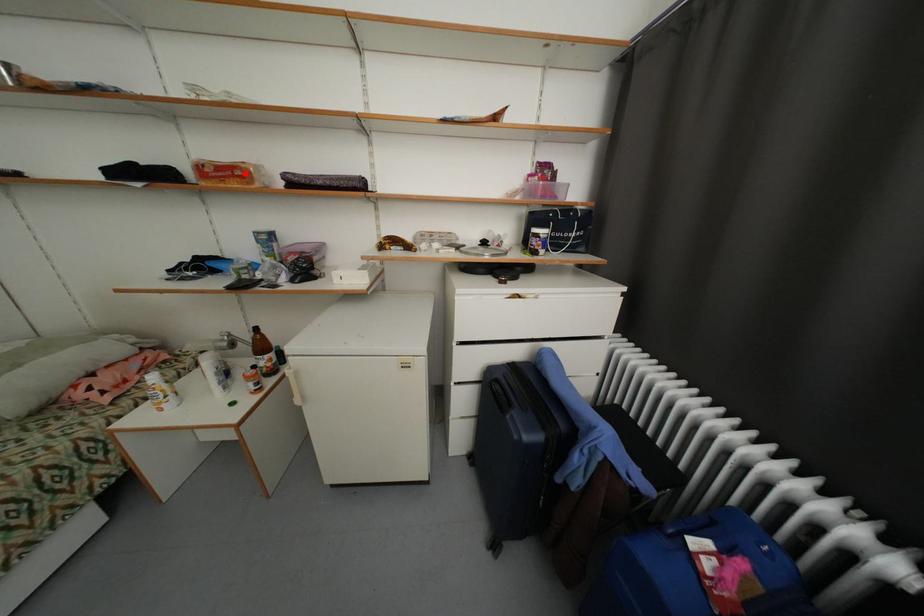
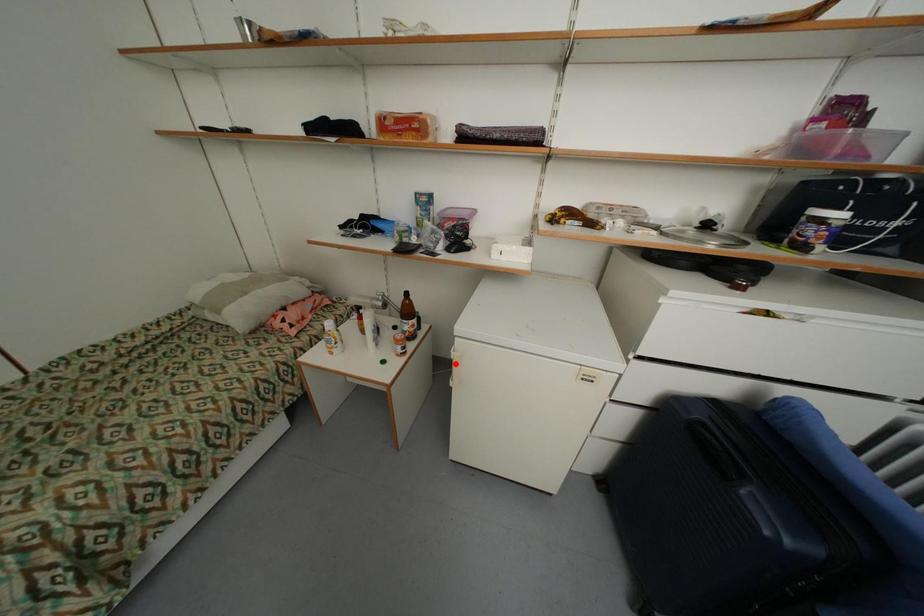
I am providing you with two images of the same scene from different viewpoints. A red point is marked on the first image and another point is marked on the second image. Does the point marked in image1 correspond to the same location as the one in image2?

No